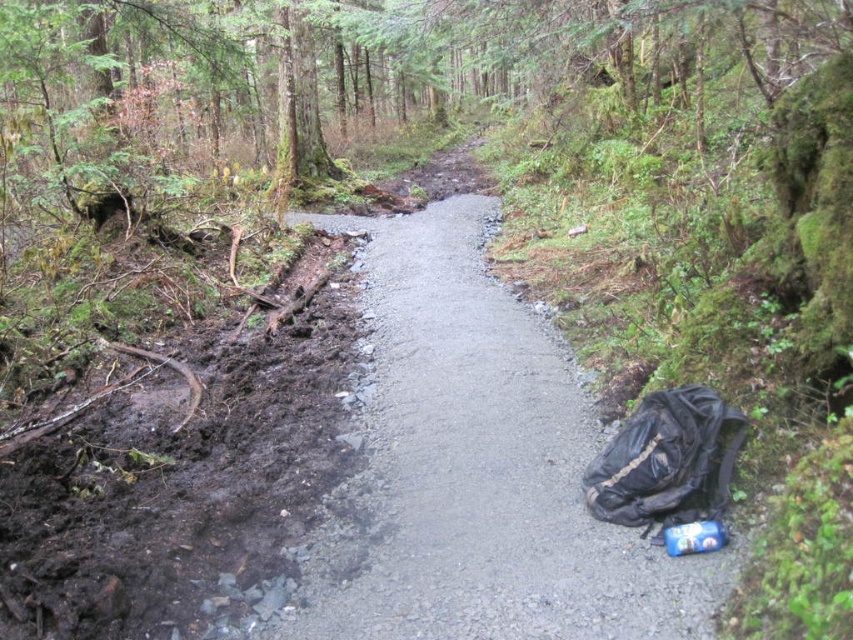
Question: Where is dark brown mud at lower left located in relation to black fabric backpack at lower right in the image?

Choices:
 (A) left
 (B) right

Answer: (A)

Question: Which object is the farthest from the black fabric backpack at lower right?

Choices:
 (A) gray asphalt path at center
 (B) dark brown mud at lower left

Answer: (B)

Question: Is gray asphalt path at center bigger than black fabric backpack at lower right?

Choices:
 (A) no
 (B) yes

Answer: (B)

Question: Is gray asphalt path at center behind black fabric backpack at lower right?

Choices:
 (A) yes
 (B) no

Answer: (B)

Question: Which of these objects is positioned farthest from the dark brown mud at lower left?

Choices:
 (A) black fabric backpack at lower right
 (B) gray asphalt path at center

Answer: (A)

Question: Among these objects, which one is nearest to the camera?

Choices:
 (A) gray asphalt path at center
 (B) black fabric backpack at lower right

Answer: (A)